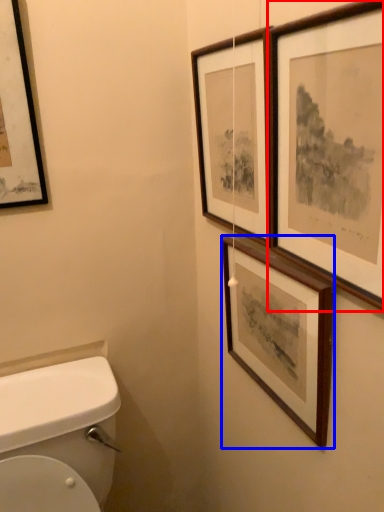
Question: Which object appears closest to the camera in this image, picture frame (highlighted by a red box) or picture frame (highlighted by a blue box)?

Choices:
 (A) picture frame
 (B) picture frame

Answer: (A)